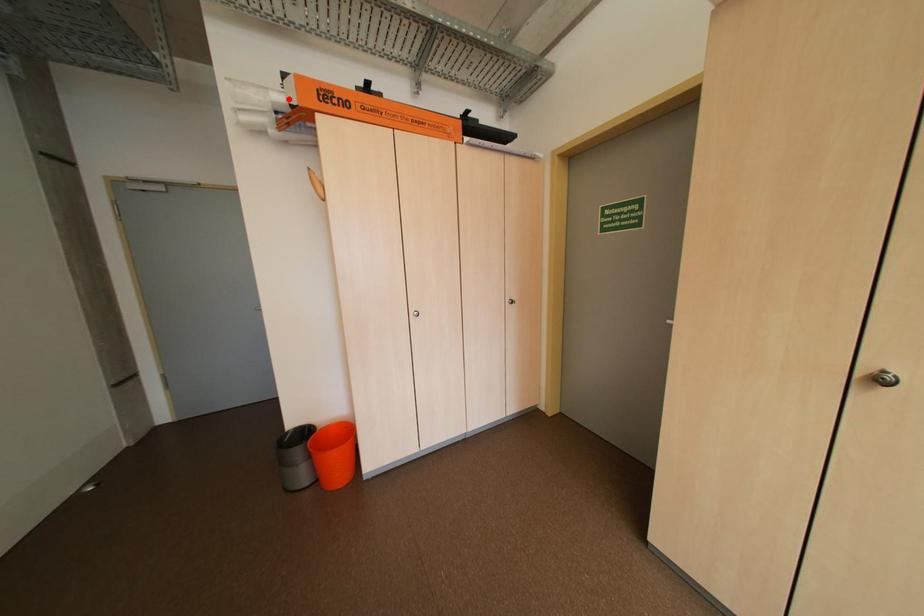
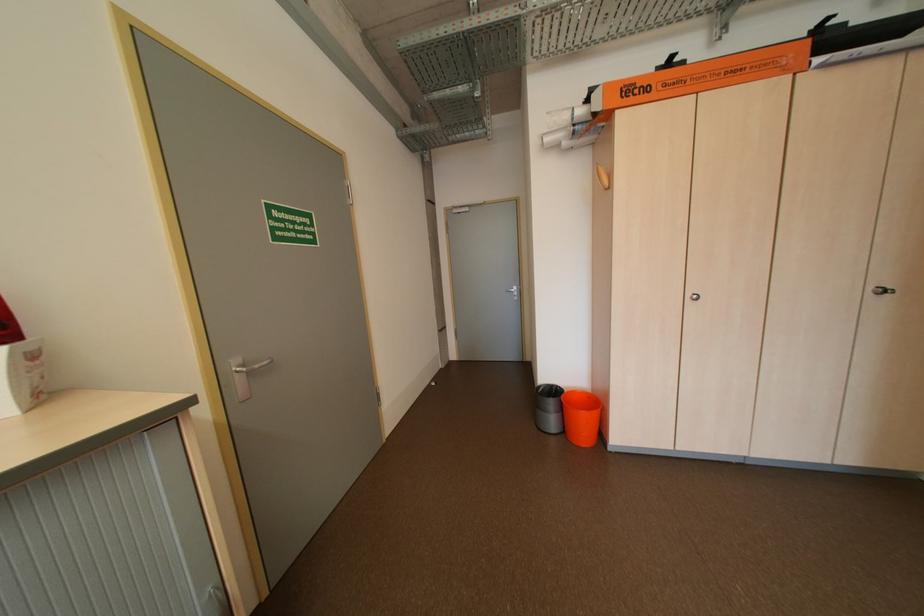
In the second image, find the point that corresponds to the highlighted location in the first image.

(590, 113)